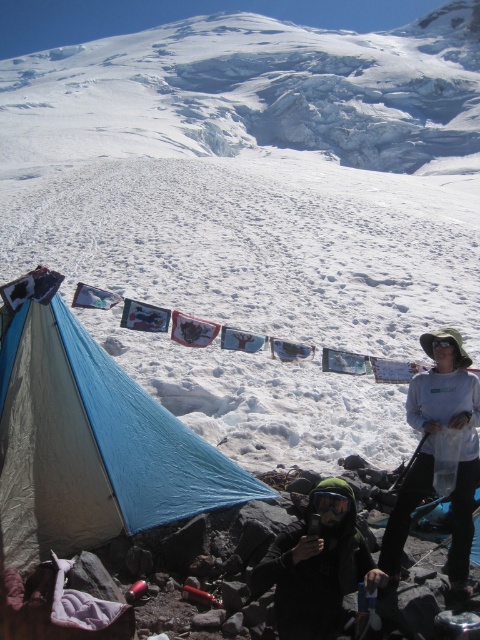
You are standing at the campsite and want to take a photo of the two points mentioned. Which point, point (385, 545) or point (273, 572), will appear closer to the camera in the photo?

Point (385, 545) will appear closer to the camera in the photo because it is further to the camera than point (273, 572).

You are a hiker trying to locate your tent. You see the blue fabric tent at lower left and the white cotton shirt at right. Which object is positioned more to the left?

The blue fabric tent at lower left is positioned more to the left than the white cotton shirt at right.